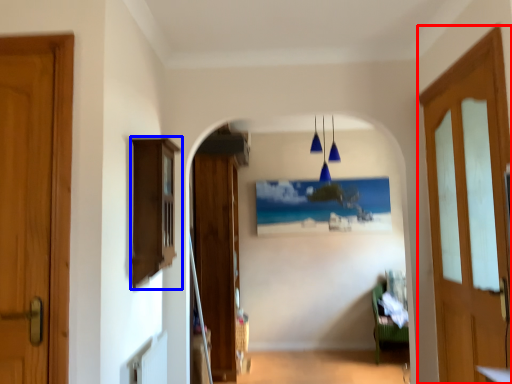
Question: Among these objects, which one is farthest to the camera, door (highlighted by a red box) or cabinetry (highlighted by a blue box)?

Choices:
 (A) door
 (B) cabinetry

Answer: (B)